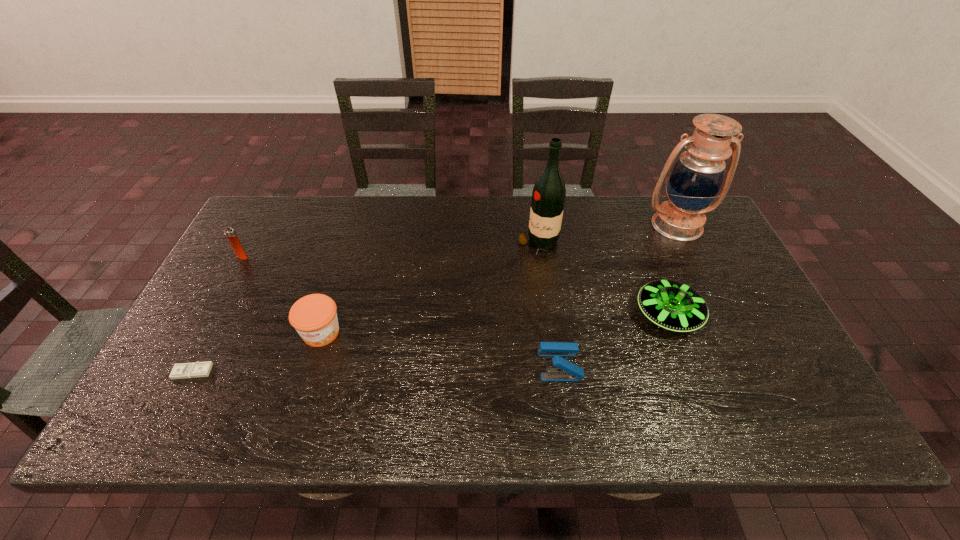
At what (x,y) coordinates should I click in order to perform the action: click on free space that satisfies the following two spatial constraints: 1. on the front side of the stapler; 2. on the left side of the wine bottle. Please return your answer as a coordinate pair (x, y). The image size is (960, 540). Looking at the image, I should click on (556, 365).